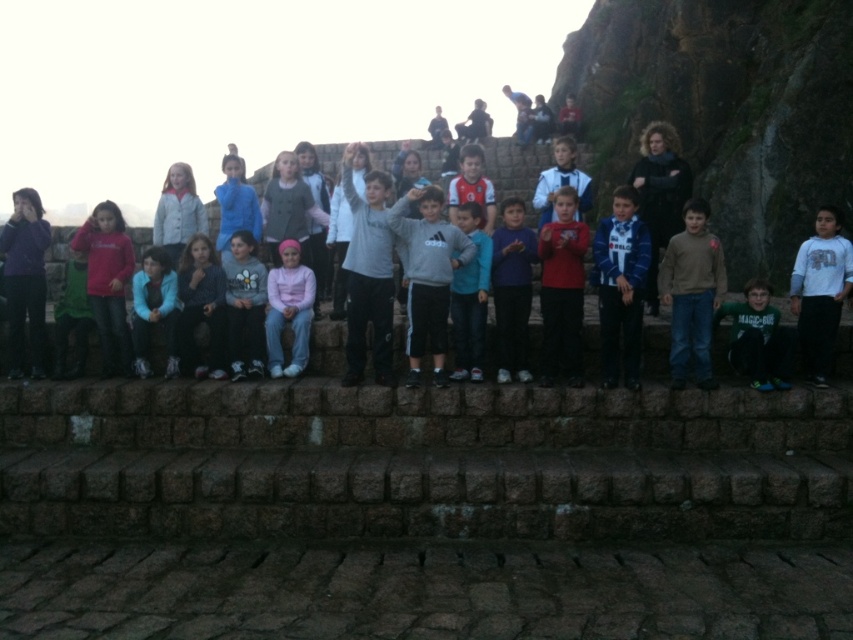
Question: Which of the following is the farthest from the observer?

Choices:
 (A) (135, 371)
 (B) (821, 228)
 (C) (282, 323)

Answer: (B)

Question: Which point appears farthest from the camera in this image?

Choices:
 (A) (466, 371)
 (B) (833, 211)
 (C) (572, 61)
 (D) (410, 259)

Answer: (C)

Question: Does green jersey at lower right appear on the right side of matte blue jacket at lower left?

Choices:
 (A) no
 (B) yes

Answer: (B)

Question: Does matte red shirt at left have a smaller size compared to blue fleece jacket at center?

Choices:
 (A) no
 (B) yes

Answer: (A)

Question: Is matte black pants at center further to camera compared to green jersey at lower right?

Choices:
 (A) yes
 (B) no

Answer: (A)

Question: Among these objects, which one is nearest to the camera?

Choices:
 (A) red matte shirt at center
 (B) matte black pants at center
 (C) pink fleece sweater at center
 (D) green jersey at lower right

Answer: (D)